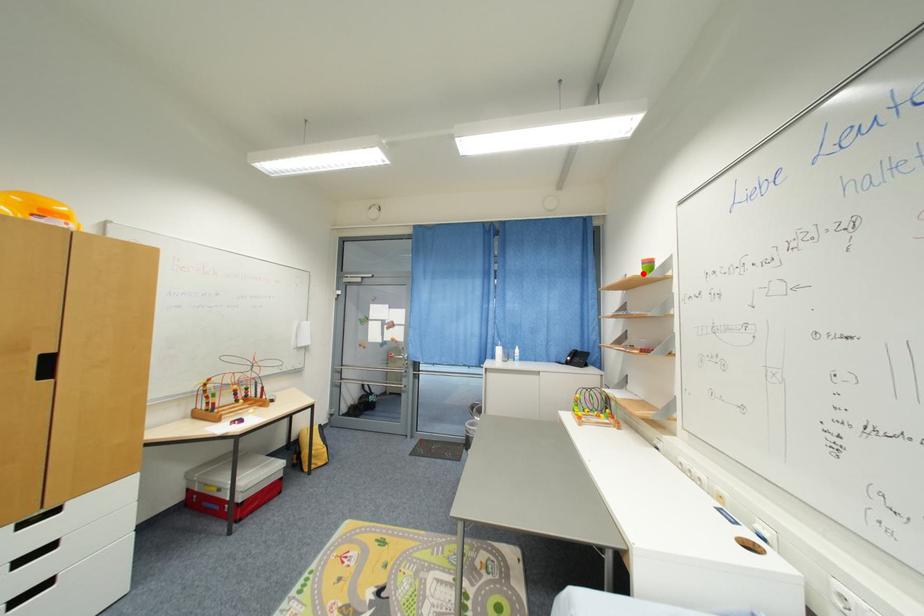
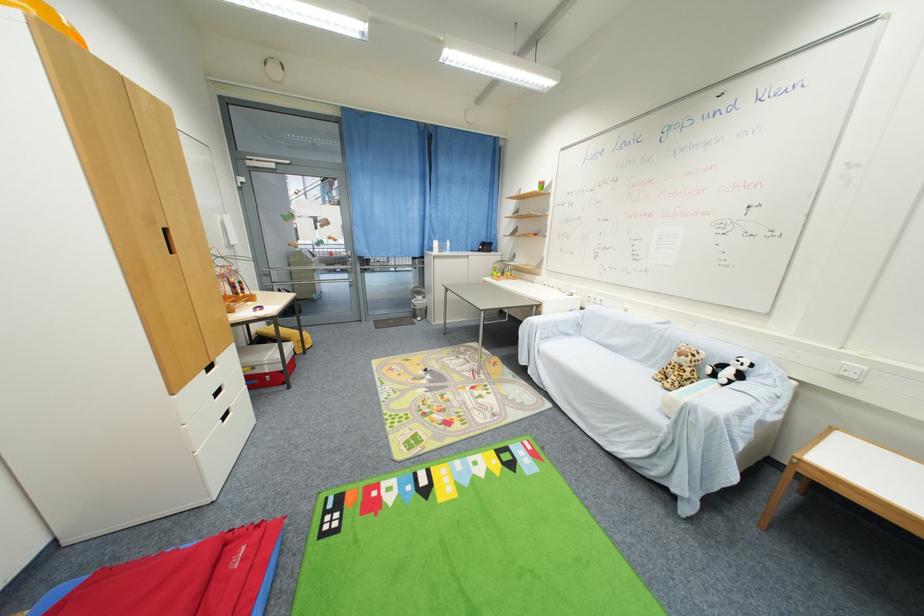
Question: A red point is marked in image1. In image2, is the corresponding 3D point closer to the camera or farther? Reply with the corresponding letter.

Choices:
 (A) The corresponding 3D point is closer.
 (B) The corresponding 3D point is farther.

Answer: (A)